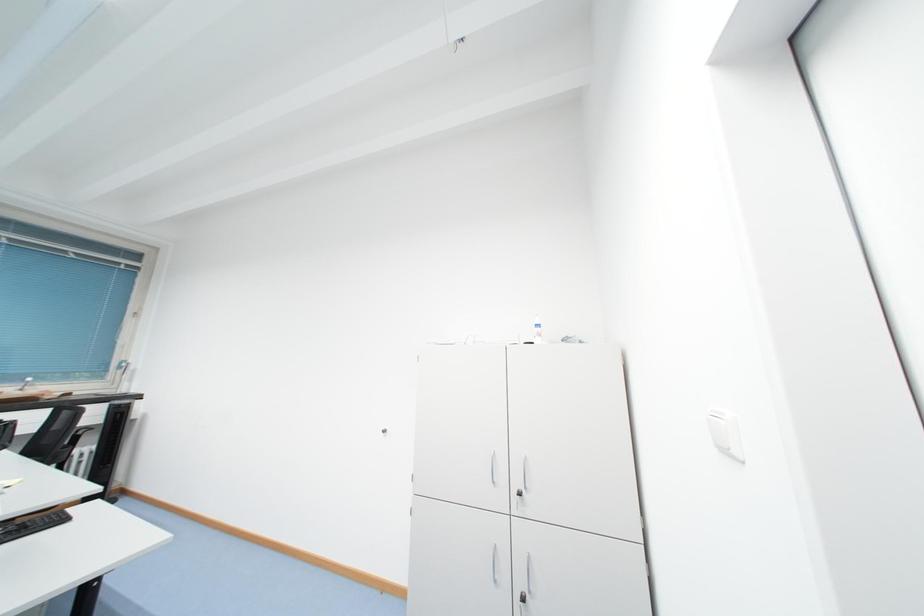
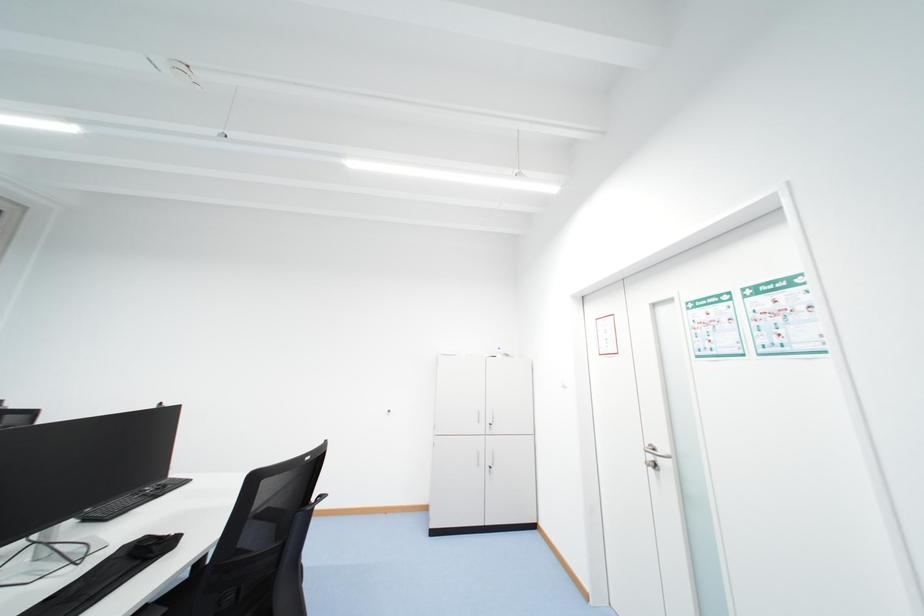
Which direction would the cameraman need to move to produce the second image?

The movement direction of the cameraman is left, backward.